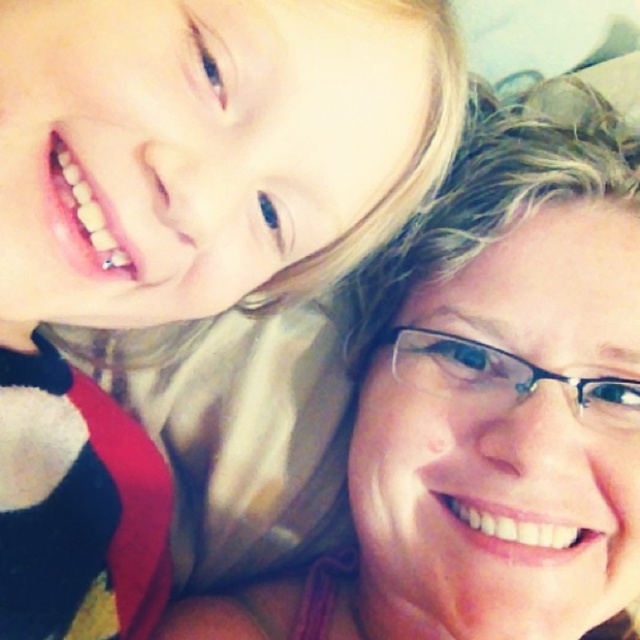
Between matte black shirt at upper left and matte skin at upper right, which one is positioned higher?

matte black shirt at upper left

Which is in front, point (420, 195) or point (490, 609)?

Point (490, 609)

Locate an element on the screen. matte black shirt at upper left is located at coordinates (177, 236).